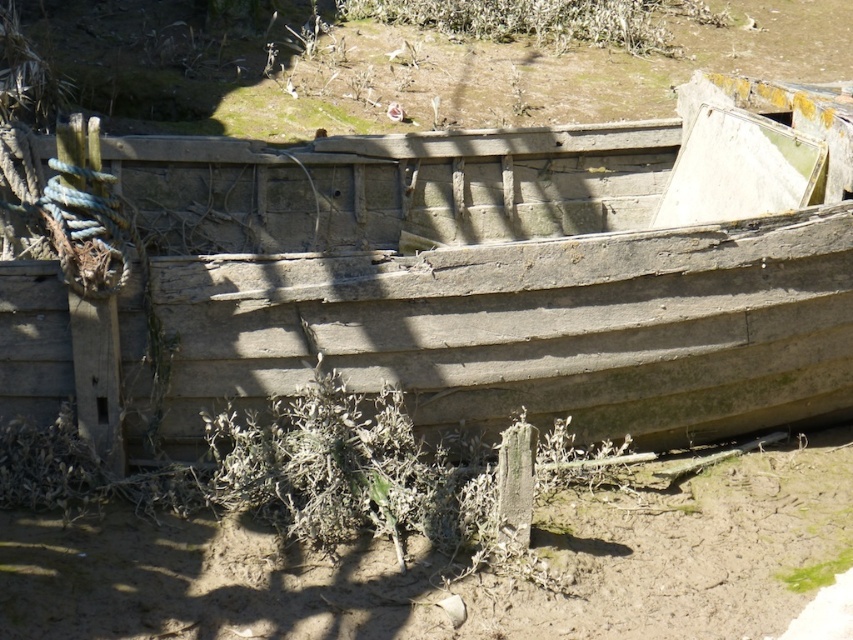
You are a photographer trying to capture the weathered wood boat at center and the brown sandy soil at lower center in a single frame. Which object should you focus on first if you want to ensure both are in the shot without moving the camera?

You should focus on the weathered wood boat at center first because it is larger than the brown sandy soil at lower center, making it easier to frame both objects in the shot.

You are a painter who wants to paint a scene of the weathered wood boat at center and the brown sandy soil at lower center. You need to know which object is wider. Can you tell me which one is wider?

The weathered wood boat at center is wider than the brown sandy soil at lower center according to the description.

You are a gardener who wants to water the green leafy plant at upper center using a hose that can reach up to 5 meters. You are currently standing next to the weathered wood boat at center. Can you reach the plant without moving your position?

The distance between the weathered wood boat at center and the green leafy plant at upper center is 6.24 meters, which is beyond the 5 meter reach of the hose. Therefore, you cannot water the plant without moving closer.